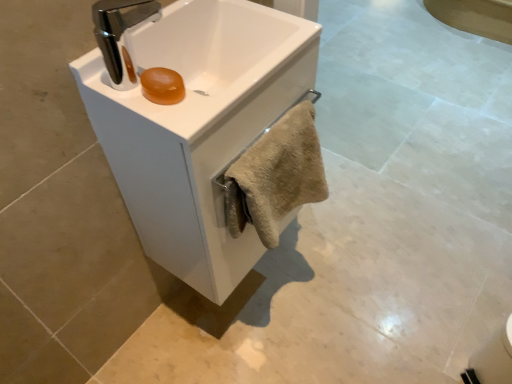
Where is `free spot below beige fuzzy towel at center (from a real-world perspective)`? This screenshot has width=512, height=384. free spot below beige fuzzy towel at center (from a real-world perspective) is located at coordinates (277, 311).